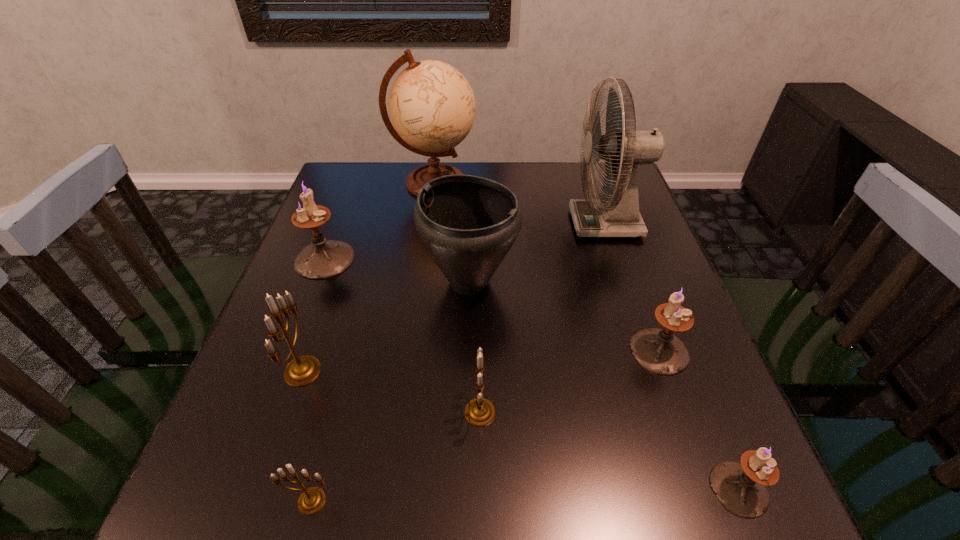
You are a GUI agent. You are given a task and a screenshot of the screen. Output one action in this format:
    pyautogui.click(x=<x>, y=<y>)
    Task: Click on the gold candelabrum that stands as the second closest to the farthest purple candle holder
    
    Given the screenshot: What is the action you would take?
    pyautogui.click(x=479, y=412)

I want to click on blank space that satisfies the following two spatial constraints: 1. on the front side of the leftmost purple candle holder; 2. on the left side of the fourth candle holder from right to left, so click(x=233, y=501).

What are the coordinates of `vacant space that satisfies the following two spatial constraints: 1. on the back side of the urn; 2. on the right side of the nearest gold candelabrum` in the screenshot? It's located at (369, 282).

Find the location of a particular element. The height and width of the screenshot is (540, 960). free space that satisfies the following two spatial constraints: 1. on the surface of the second nearest purple candle holder; 2. on the right side of the globe is located at coordinates (410, 351).

Where is `vacant area in the image that satisfies the following two spatial constraints: 1. on the front-facing side of the gray fan; 2. on the front side of the leftmost gold candelabrum`? Image resolution: width=960 pixels, height=540 pixels. vacant area in the image that satisfies the following two spatial constraints: 1. on the front-facing side of the gray fan; 2. on the front side of the leftmost gold candelabrum is located at coordinates click(655, 371).

Where is `free space that satisfies the following two spatial constraints: 1. on the front side of the second smallest purple candle holder; 2. on the right side of the smallest purple candle holder`? free space that satisfies the following two spatial constraints: 1. on the front side of the second smallest purple candle holder; 2. on the right side of the smallest purple candle holder is located at coordinates (x=708, y=489).